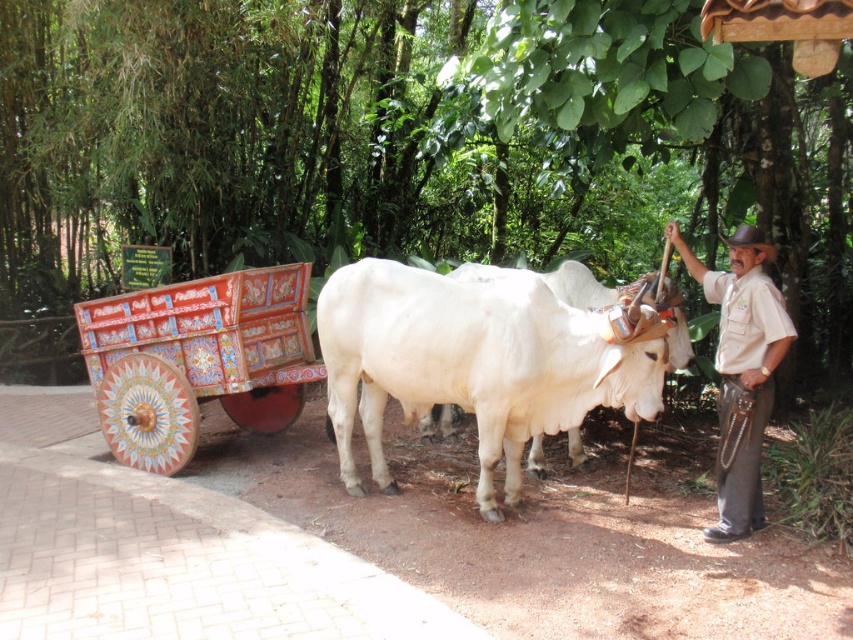
You are a photographer planning to take a photo of the beige uniform at center and the painted wood wagon at left. You want to ensure both subjects are fully visible in the frame. Given that the camera has a fixed width, which subject should you prioritize framing closer to the center to accommodate their sizes?

The painted wood wagon at left is wider than the beige uniform at center, so you should prioritize framing the painted wood wagon at left closer to the center to accommodate its larger width.

You are standing on the dirt path where the white ox is located. You want to look up at the green leafy tree at upper center. In which direction should you turn your head?

You should look upward because the green leafy tree at upper center is located at point (393, 145), which is above your eye level on the dirt path.